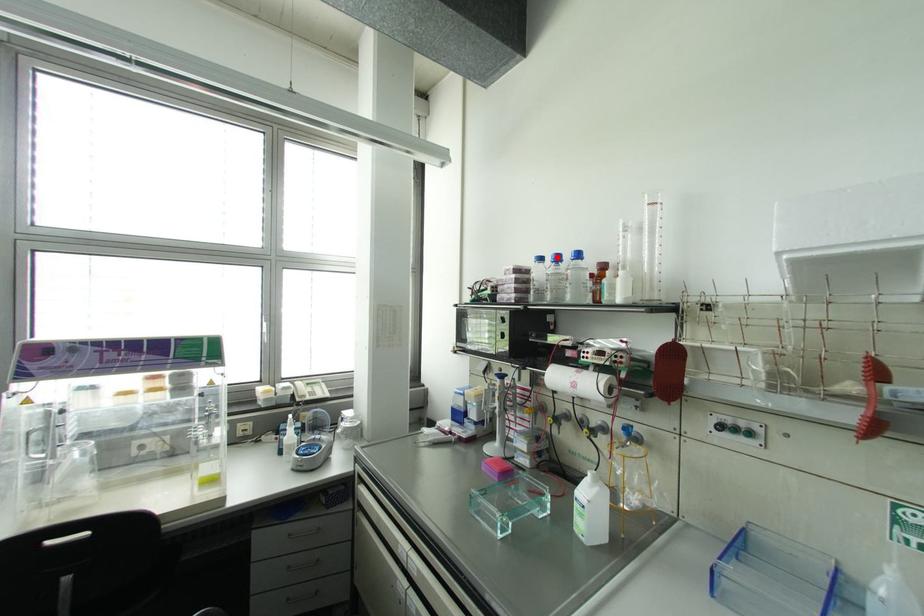
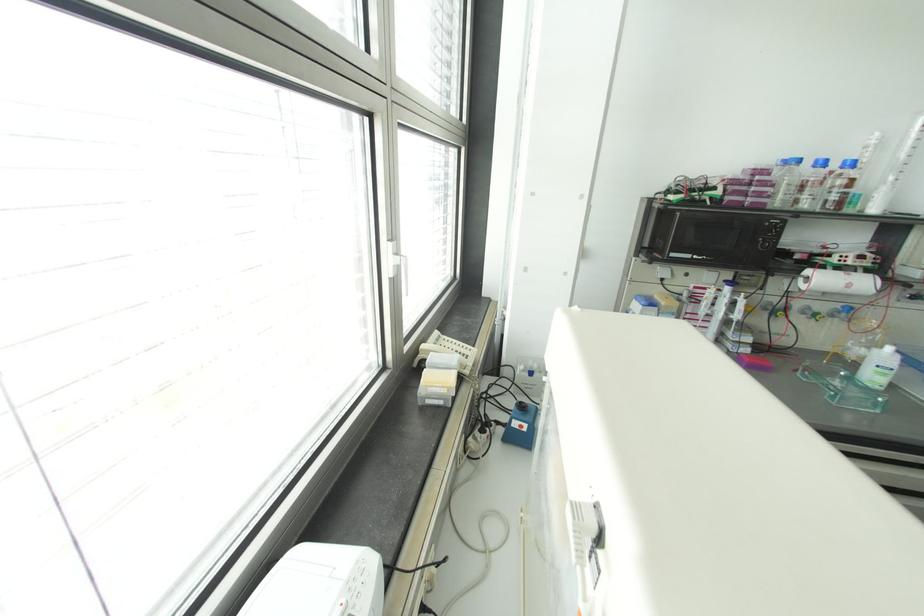
Question: A red point is marked in image1. In image2, is the corresponding 3D point closer to the camera or farther? Reply with the corresponding letter.

Choices:
 (A) The corresponding 3D point is closer.
 (B) The corresponding 3D point is farther.

Answer: (B)